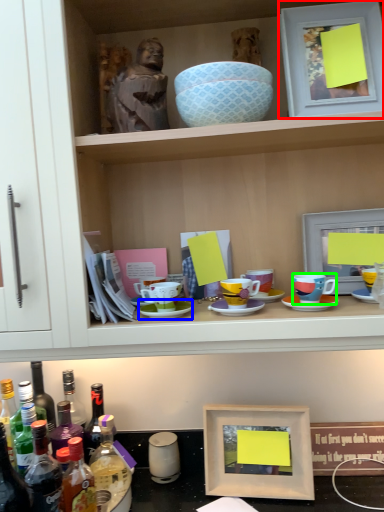
Question: Estimate the real-world distances between objects in this image. Which object is closer to picture frame (highlighted by a red box), saucer (highlighted by a blue box) or coffee cup (highlighted by a green box)?

Choices:
 (A) saucer
 (B) coffee cup

Answer: (B)